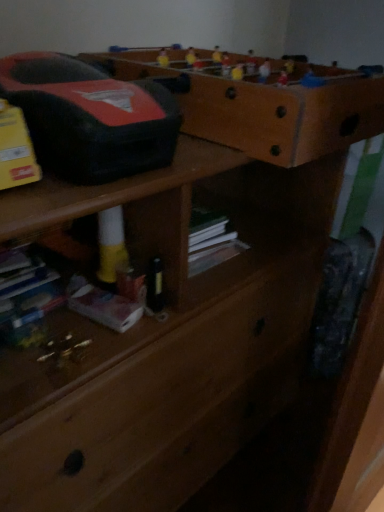
Question: Is wooden chest of drawers at center bigger than white matte book at lower left?

Choices:
 (A) no
 (B) yes

Answer: (B)

Question: Is wooden chest of drawers at center to the left of white matte book at lower left from the viewer's perspective?

Choices:
 (A) no
 (B) yes

Answer: (A)

Question: Could you tell me if wooden chest of drawers at center is turned towards white matte book at lower left?

Choices:
 (A) no
 (B) yes

Answer: (A)

Question: Would you say white matte book at lower left is part of wooden chest of drawers at center's contents?

Choices:
 (A) yes
 (B) no

Answer: (A)

Question: Is wooden chest of drawers at center looking in the opposite direction of white matte book at lower left?

Choices:
 (A) yes
 (B) no

Answer: (B)

Question: Considering the relative sizes of wooden chest of drawers at center and white matte book at lower left in the image provided, is wooden chest of drawers at center smaller than white matte book at lower left?

Choices:
 (A) yes
 (B) no

Answer: (B)

Question: Is white matte book at lower left to the left of brown wooden shelf at upper center from the viewer's perspective?

Choices:
 (A) yes
 (B) no

Answer: (A)

Question: Is white matte book at lower left positioned beyond the bounds of brown wooden shelf at upper center?

Choices:
 (A) yes
 (B) no

Answer: (A)

Question: From the image's perspective, is white matte book at lower left located above brown wooden shelf at upper center?

Choices:
 (A) no
 (B) yes

Answer: (A)

Question: Is white matte book at lower left aimed at brown wooden shelf at upper center?

Choices:
 (A) yes
 (B) no

Answer: (B)

Question: Is white matte book at lower left bigger than brown wooden shelf at upper center?

Choices:
 (A) yes
 (B) no

Answer: (B)

Question: Does white matte book at lower left have a smaller size compared to brown wooden shelf at upper center?

Choices:
 (A) yes
 (B) no

Answer: (A)

Question: Is brown wooden shelf at upper center touching white matte book at lower left?

Choices:
 (A) yes
 (B) no

Answer: (B)